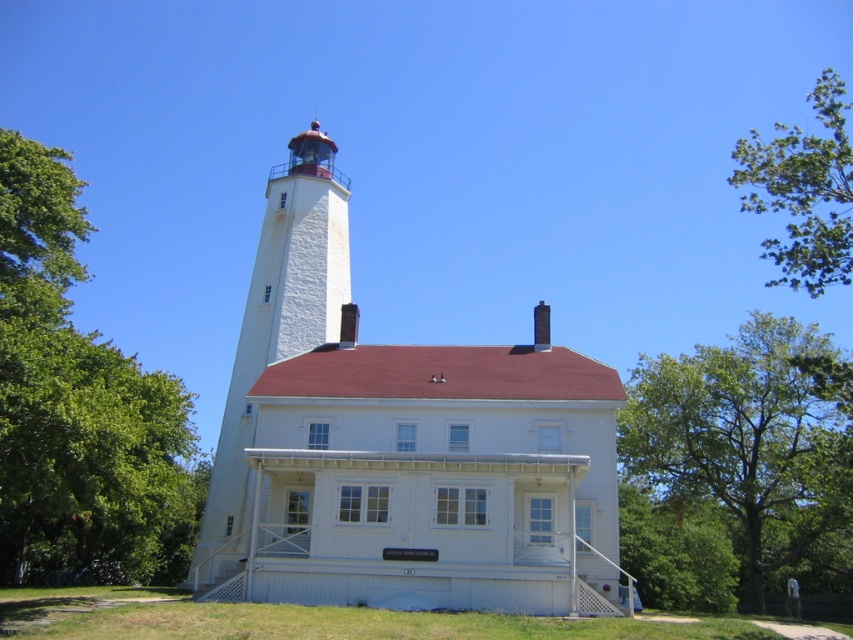
You are a gardener planning to plant a new tree in the area near the lighthouse. The green leafy tree at right and the green grass at lower center are already present. Which of these two has a smaller width, making it easier to accommodate additional plants around it?

The green leafy tree at right has a lesser width compared to green grass at lower center, so it is easier to accommodate additional plants around the green leafy tree at right.

You are standing in front of the lighthouse and want to take a photo that includes both the lighthouse and the smaller attached building. You notice two specific points marked as point 1 and point 2 on your camera screen. Point 1 is at coordinates (247,305) and point 2 is at (4,611). Which point is closer to the camera?

Point 1 at coordinates (247,305) is closer to the camera than point 2 at (4,611) because the description states that point (247,305) is further to the camera than point (4,611). Wait, there seems to be a contradiction here. Let me check again. The Objects Description says Point (247,305) is further to the camera than point (4,611). Therefore, point (4,611) is closer to the camera.